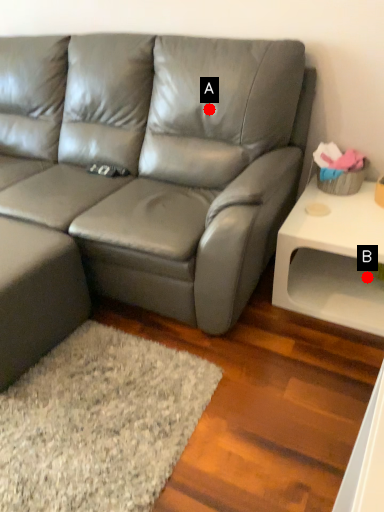
Question: Two points are circled on the image, labeled by A and B beside each circle. Which point is closer to the camera?

Choices:
 (A) A is closer
 (B) B is closer

Answer: (A)